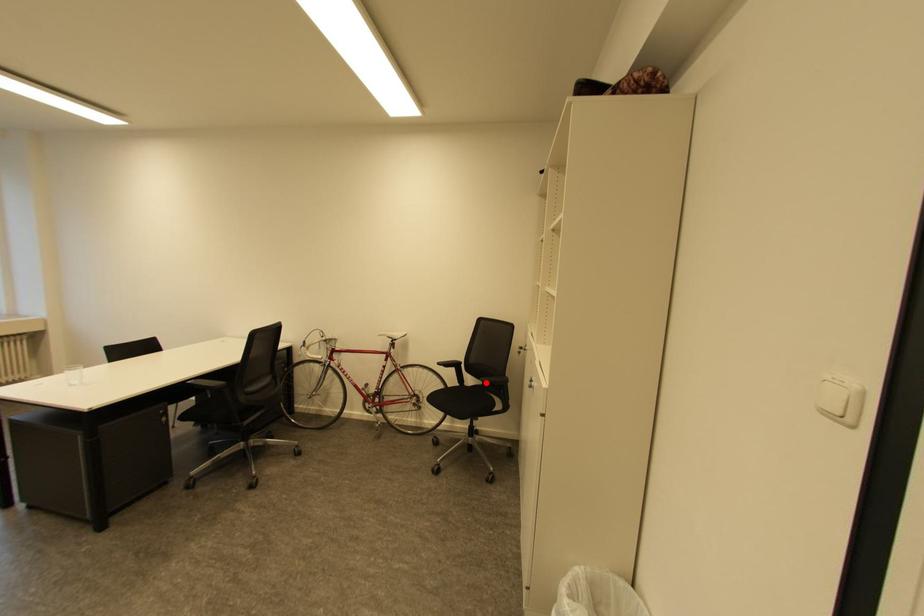
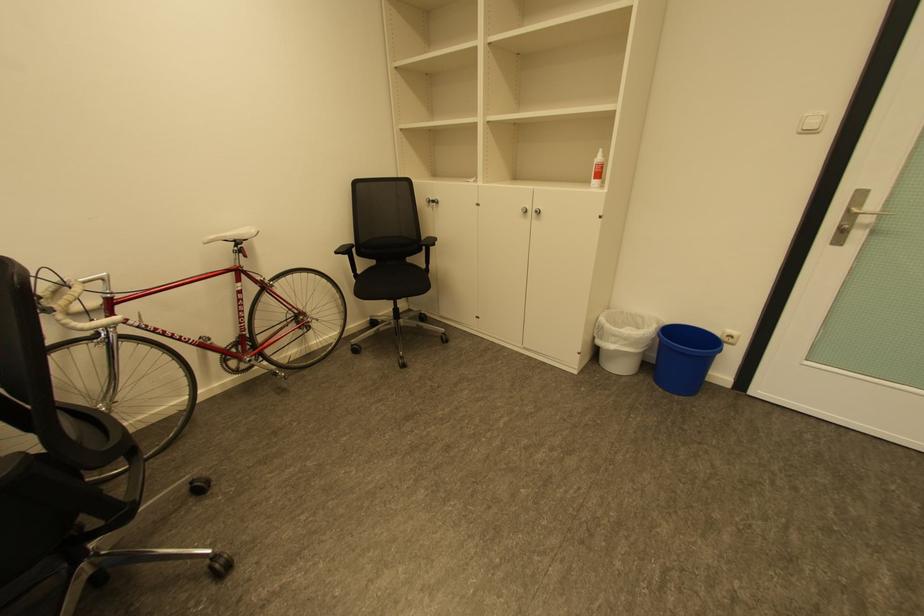
Question: I am providing you with two images of the same scene from different viewpoints. A red point is shown in image1. For the corresponding object point in image2, is it positioned nearer or farther from the camera?

Choices:
 (A) Nearer
 (B) Farther

Answer: (A)